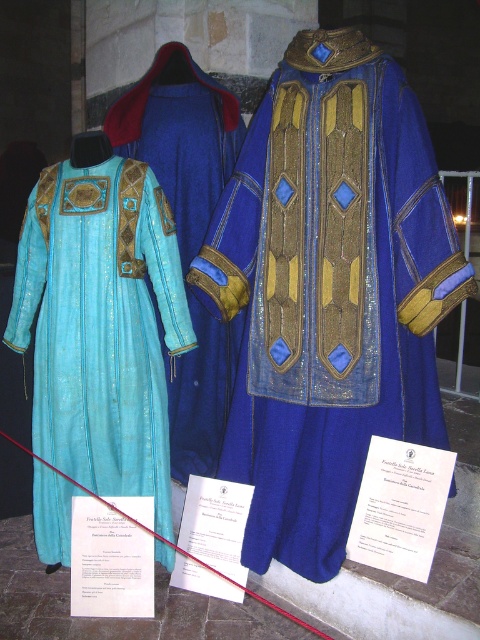
Can you confirm if blue velvet robe at center is thinner than turquoise velvet robe at center?

Incorrect, blue velvet robe at center's width is not less than turquoise velvet robe at center's.

The width and height of the screenshot is (480, 640). What do you see at coordinates (328, 291) in the screenshot?
I see `blue velvet robe at center` at bounding box center [328, 291].

I want to click on blue velvet robe at center, so click(x=328, y=291).

Is point (290, 403) farther from viewer compared to point (101, 262)?

No, it is in front of (101, 262).

Does blue velvet robe at center have a larger size compared to matte blue fabric dress at left?

Correct, blue velvet robe at center is larger in size than matte blue fabric dress at left.

What do you see at coordinates (328, 291) in the screenshot? The image size is (480, 640). I see `blue velvet robe at center` at bounding box center [328, 291].

Locate an element on the screen. The width and height of the screenshot is (480, 640). blue velvet robe at center is located at coordinates click(x=328, y=291).

Is matte blue fabric dress at left to the right of turquoise velvet robe at center from the viewer's perspective?

In fact, matte blue fabric dress at left is to the left of turquoise velvet robe at center.

Which of these two, matte blue fabric dress at left or turquoise velvet robe at center, stands shorter?

matte blue fabric dress at left

Find the location of a particular element. matte blue fabric dress at left is located at coordinates (100, 324).